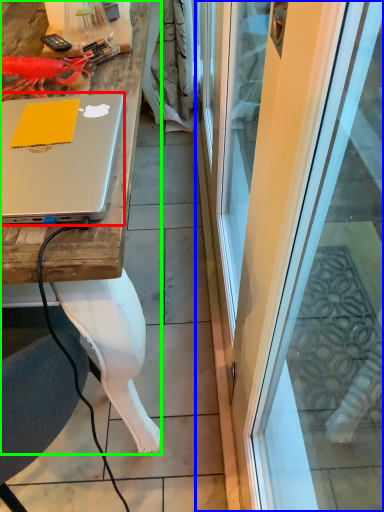
Question: Which is nearer to the laptop (highlighted by a red box)? screen door (highlighted by a blue box) or desk (highlighted by a green box).

Choices:
 (A) screen door
 (B) desk

Answer: (B)